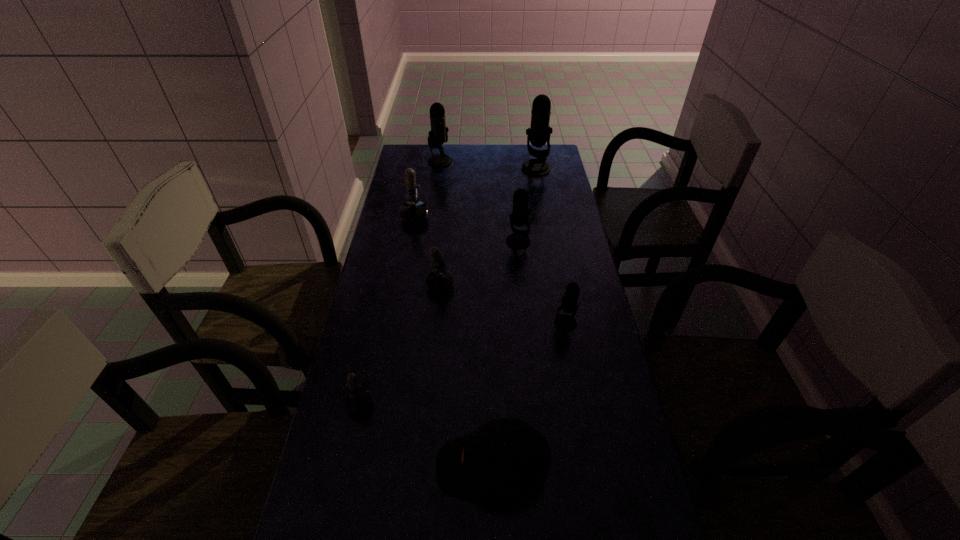
Locate which microphone is the third closest to the second biggest black microphone. Please provide its 2D coordinates. Your answer should be formatted as a tuple, i.e. [(x, y)], where the tuple contains the x and y coordinates of a point satisfying the conditions above.

[(519, 239)]

You are a GUI agent. You are given a task and a screenshot of the screen. Output one action in this format:
    pyautogui.click(x=<x>, y=<y>)
    Task: Click on the black microphone that is the fourth closest to the biggest white microphone
    The width and height of the screenshot is (960, 540).
    Given the screenshot: What is the action you would take?
    pyautogui.click(x=564, y=322)

This screenshot has width=960, height=540. In order to click on black microphone that is the third nearest to the fifth nearest object in this screenshot , I will do `click(438, 135)`.

Identify the location of white microphone that is the closest to the fourth nearest object. (358, 400).

Choose which white microphone is the nearest neighbor to the biggest black microphone. Please provide its 2D coordinates. Your answer should be formatted as a tuple, i.e. [(x, y)], where the tuple contains the x and y coordinates of a point satisfying the conditions above.

[(413, 210)]

In order to click on free space that satisfies the following two spatial constraints: 1. on the back side of the smallest white microphone; 2. on the right side of the second nearest white microphone in this screenshot , I will do `click(385, 287)`.

Locate an element on the screen. The height and width of the screenshot is (540, 960). vacant space that satisfies the following two spatial constraints: 1. on the front side of the second smallest black microphone; 2. with a logo on the front of the baseball cap is located at coordinates (540, 467).

Image resolution: width=960 pixels, height=540 pixels. I want to click on vacant region that satisfies the following two spatial constraints: 1. on the back side of the sixth shortest microphone; 2. on the left side of the seventh farthest object, so click(413, 161).